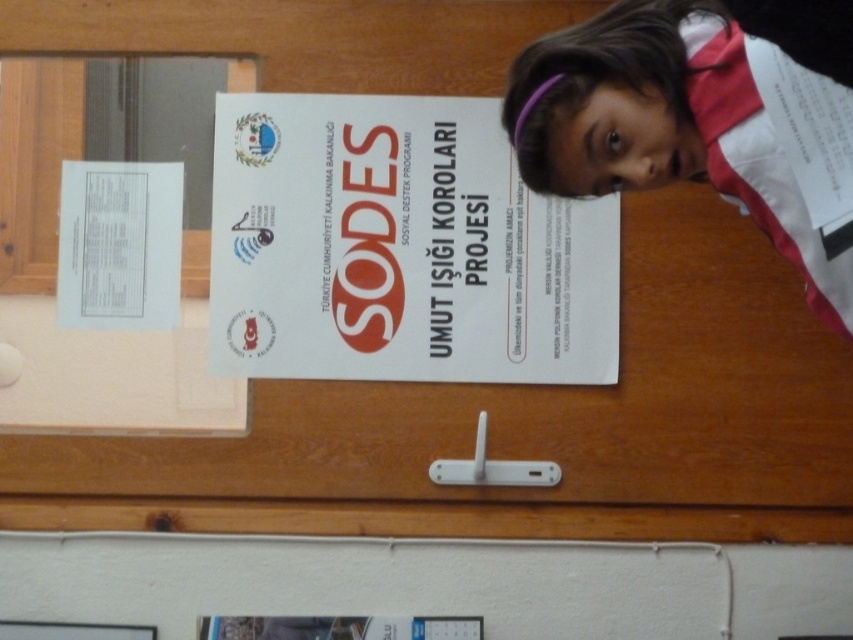
You are standing in front of the wooden door and want to hang a small hook between the white paper poster at center and the white fabric headband at upper right. The hook requires 12 inches of space between the two objects to be safely installed. Can you fit the hook between them?

The distance between the white paper poster at center and the white fabric headband at upper right is 23.29 inches, which is more than the required 12 inches, so the hook can be safely installed between them.